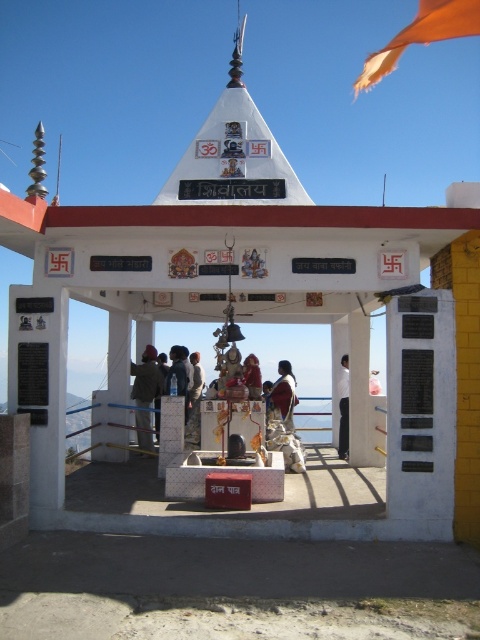
You are standing at the entrance of the temple and see the point marked at coordinates (145,394). What object is located at that point?

The point at coordinates (145,394) corresponds to the dark brown jacket at center.

You are visiting the temple and see the brown fabric saree at center and the white fabric at center. Which fabric is positioned to the left?

The brown fabric saree at center is positioned to the left of the white fabric at center.

You are a visitor to the temple and want to place a small offering on the altar. The offering is 10 cm wide. You see the white fabric at center and the matte gold statue at center. Which object on the altar has enough space next to it to place your offering?

The white fabric at center is thinner than the matte gold statue at center, so there is more space next to the white fabric at center to place the offering.